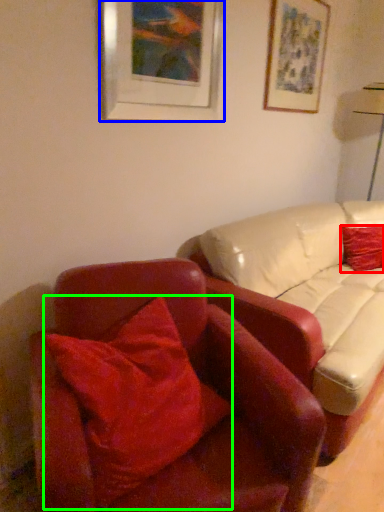
Question: Considering the real-world distances, which object is closest to pillow (highlighted by a red box)? picture frame (highlighted by a blue box) or pillow (highlighted by a green box).

Choices:
 (A) picture frame
 (B) pillow

Answer: (A)